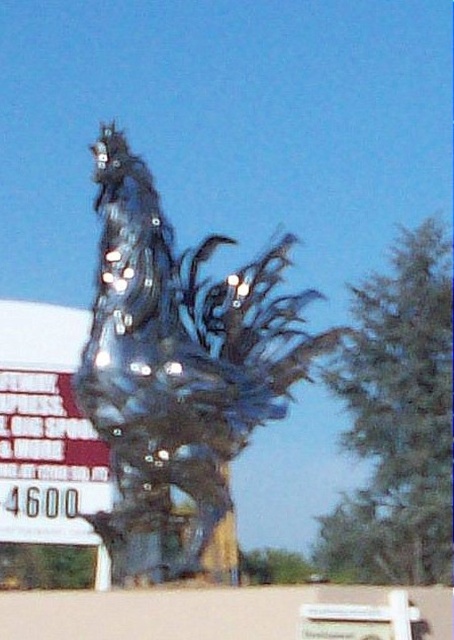
Question: Does glossy glass rooster at center have a smaller size compared to white paper sign at left?

Choices:
 (A) yes
 (B) no

Answer: (B)

Question: Is glossy glass rooster at center to the right of white paper sign at left from the viewer's perspective?

Choices:
 (A) no
 (B) yes

Answer: (B)

Question: Among these objects, which one is nearest to the camera?

Choices:
 (A) white paper sign at left
 (B) glossy glass rooster at center

Answer: (B)

Question: Considering the relative positions of glossy glass rooster at center and white paper sign at left in the image provided, where is glossy glass rooster at center located with respect to white paper sign at left?

Choices:
 (A) above
 (B) below

Answer: (A)

Question: Which point appears farthest from the camera in this image?

Choices:
 (A) (74, 493)
 (B) (114, 152)

Answer: (A)